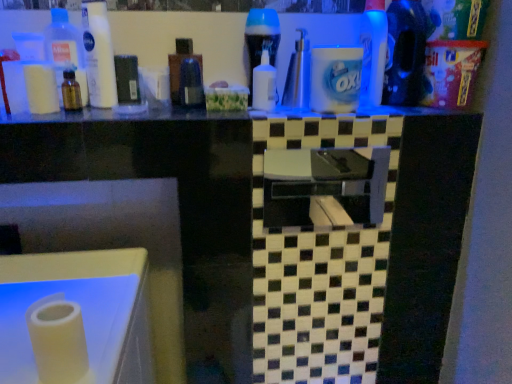
The image size is (512, 384). I want to click on free space above black glossy counter top at upper center (from a real-world perspective), so click(x=225, y=108).